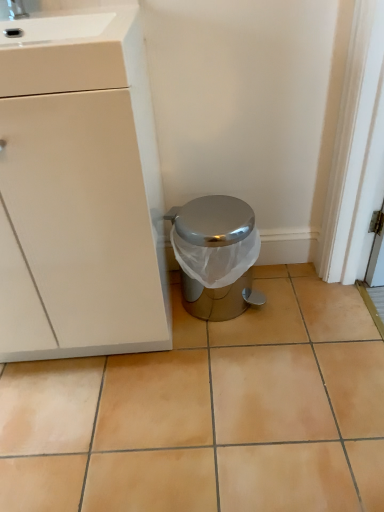
What do you see at coordinates (209, 413) in the screenshot? This screenshot has height=512, width=384. I see `beige ceramic tile at center` at bounding box center [209, 413].

Locate an element on the screen. white matte cabinet at left is located at coordinates (79, 191).

Considering the relative sizes of shiny metallic trash can at center and beige ceramic tile at center in the image provided, is shiny metallic trash can at center thinner than beige ceramic tile at center?

Yes.

How much distance is there between shiny metallic trash can at center and beige ceramic tile at center?

shiny metallic trash can at center and beige ceramic tile at center are 13.56 inches apart.

Is shiny metallic trash can at center at the right side of beige ceramic tile at center?

Yes, shiny metallic trash can at center is to the right of beige ceramic tile at center.

Is shiny metallic trash can at center situated inside beige ceramic tile at center or outside?

shiny metallic trash can at center lies outside beige ceramic tile at center.

Is point (146, 85) farther from viewer compared to point (345, 324)?

No.

In the image, is white matte cabinet at left positioned in front of or behind beige ceramic tile at center?

Clearly, white matte cabinet at left is in front of beige ceramic tile at center.

Is white matte cabinet at left far from beige ceramic tile at center?

Actually, white matte cabinet at left and beige ceramic tile at center are a little close together.

From the image's perspective, is white matte cabinet at left positioned above or below beige ceramic tile at center?

white matte cabinet at left is above beige ceramic tile at center.

Is beige ceramic tile at center shorter than white matte cabinet at left?

Correct, beige ceramic tile at center is not as tall as white matte cabinet at left.

Is beige ceramic tile at center thinner than white matte cabinet at left?

No, beige ceramic tile at center is not thinner than white matte cabinet at left.

How much distance is there between beige ceramic tile at center and white matte cabinet at left?

A distance of 15.57 inches exists between beige ceramic tile at center and white matte cabinet at left.

Is point (189, 378) less distant than point (9, 269)?

No, it is not.

From their relative heights in the image, would you say white matte cabinet at left is taller or shorter than shiny metallic trash can at center?

white matte cabinet at left is taller than shiny metallic trash can at center.

Is the position of white matte cabinet at left more distant than that of shiny metallic trash can at center?

That is False.

Is white matte cabinet at left oriented away from shiny metallic trash can at center?

No, white matte cabinet at left is not facing away from shiny metallic trash can at center.

Is white matte cabinet at left touching shiny metallic trash can at center?

white matte cabinet at left and shiny metallic trash can at center are clearly separated.

Can you confirm if shiny metallic trash can at center is thinner than white matte cabinet at left?

Indeed, shiny metallic trash can at center has a lesser width compared to white matte cabinet at left.

Which is further, (202, 220) or (124, 80)?

The point (202, 220) is farther.

Between shiny metallic trash can at center and white matte cabinet at left, which one is positioned behind?

shiny metallic trash can at center is more distant.

Locate an element on the screen. The width and height of the screenshot is (384, 512). waste container lying on the right of white matte cabinet at left is located at coordinates (215, 255).

From a real-world perspective, is beige ceramic tile at center above or below shiny metallic trash can at center?

Clearly, from a real-world perspective, beige ceramic tile at center is below shiny metallic trash can at center.

Is point (335, 455) farther from viewer compared to point (198, 267)?

No, (335, 455) is closer to viewer.

Where is `waste container above the beige ceramic tile at center (from the image's perspective)`? The image size is (384, 512). waste container above the beige ceramic tile at center (from the image's perspective) is located at coordinates (215, 255).

I want to click on waste container above the beige ceramic tile at center (from the image's perspective), so click(215, 255).

At what (x,y) coordinates should I click in order to perform the action: click on ceramic tile that is on the right side of white matte cabinet at left. Please return your answer as a coordinate pair (x, y). Looking at the image, I should click on (209, 413).

When comparing their distances from white matte cabinet at left, does shiny metallic trash can at center or beige ceramic tile at center seem closer?

shiny metallic trash can at center.

Estimate the real-world distances between objects in this image. Which object is closer to white matte cabinet at left, beige ceramic tile at center or shiny metallic trash can at center?

shiny metallic trash can at center is positioned closer to the anchor white matte cabinet at left.

When comparing their distances from shiny metallic trash can at center, does beige ceramic tile at center or white matte cabinet at left seem further?

beige ceramic tile at center lies further to shiny metallic trash can at center than the other object.

From the picture: Considering their positions, is white matte cabinet at left positioned further to beige ceramic tile at center than shiny metallic trash can at center?

white matte cabinet at left lies further to beige ceramic tile at center than the other object.

Looking at this image, from the image, which object appears to be nearer to shiny metallic trash can at center, white matte cabinet at left or beige ceramic tile at center?

Based on the image, white matte cabinet at left appears to be nearer to shiny metallic trash can at center.

When comparing their distances from beige ceramic tile at center, does shiny metallic trash can at center or white matte cabinet at left seem further?

Based on the image, white matte cabinet at left appears to be further to beige ceramic tile at center.

You are a GUI agent. You are given a task and a screenshot of the screen. Output one action in this format:
    pyautogui.click(x=<x>, y=<y>)
    Task: Click on the ceramic tile located between white matte cabinet at left and shiny metallic trash can at center in the left-right direction
    
    Given the screenshot: What is the action you would take?
    pyautogui.click(x=209, y=413)